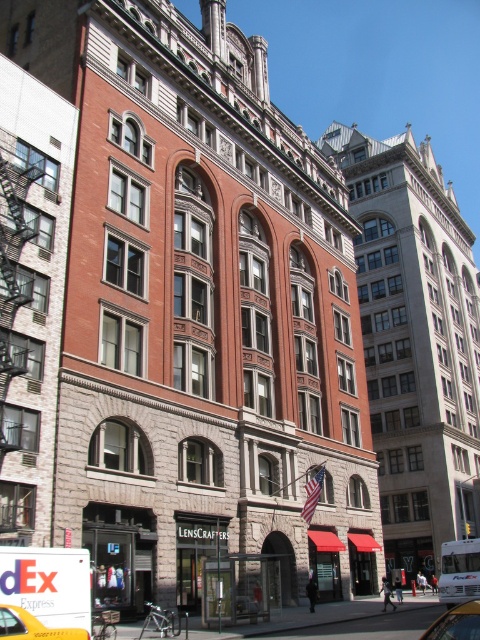
Question: Is yellow rubber taxi at lower left positioned in front of metallic silver car at lower right?

Choices:
 (A) yes
 (B) no

Answer: (B)

Question: Which point appears farthest from the camera in this image?

Choices:
 (A) (429, 628)
 (B) (13, 614)

Answer: (A)

Question: Considering the relative positions of yellow rubber taxi at lower left and metallic silver car at lower right in the image provided, where is yellow rubber taxi at lower left located with respect to metallic silver car at lower right?

Choices:
 (A) right
 (B) left

Answer: (B)

Question: Which point is farther from the camera taking this photo?

Choices:
 (A) (29, 637)
 (B) (450, 637)

Answer: (A)

Question: Is yellow rubber taxi at lower left to the right of metallic silver car at lower right from the viewer's perspective?

Choices:
 (A) yes
 (B) no

Answer: (B)